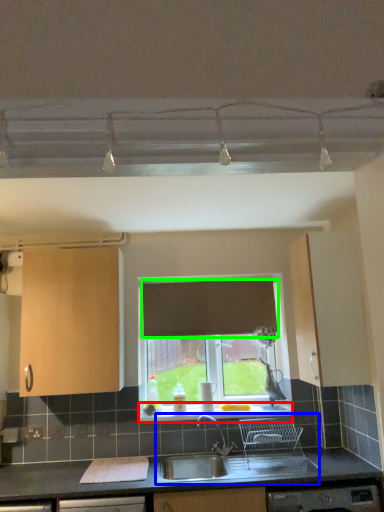
Question: Which object is the farthest from window sill (highlighted by a red box)? Choose among these: sink (highlighted by a blue box) or curtain (highlighted by a green box).

Choices:
 (A) sink
 (B) curtain

Answer: (B)